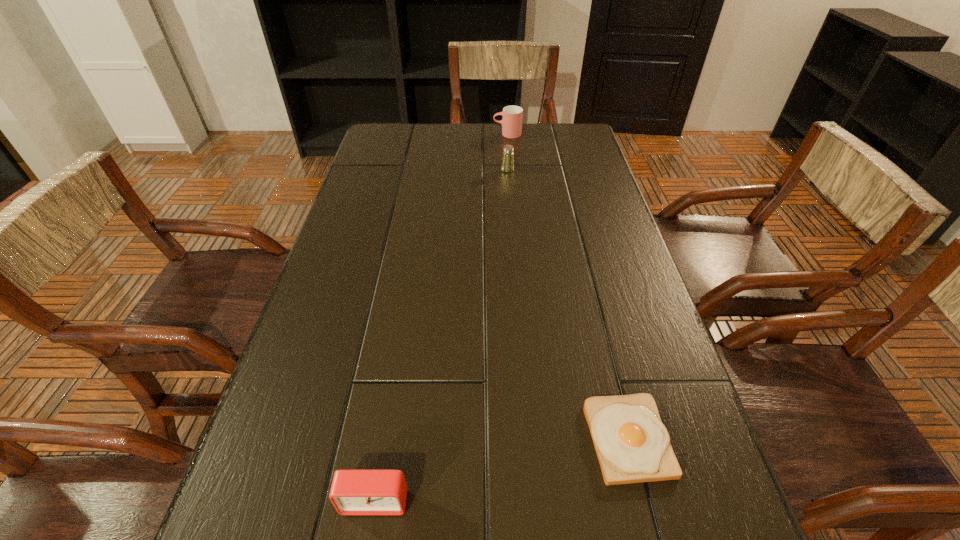
Identify the location of vacant area between the shortest object and the third nearest object. This screenshot has width=960, height=540. (567, 304).

The width and height of the screenshot is (960, 540). I want to click on free point between the alarm clock and the saltshaker, so click(442, 335).

Where is `vacant space that's between the cup and the leftmost object`? Image resolution: width=960 pixels, height=540 pixels. vacant space that's between the cup and the leftmost object is located at coordinates (441, 317).

Find the location of a particular element. The width and height of the screenshot is (960, 540). free space that is in between the rightmost object and the saltshaker is located at coordinates [567, 304].

Identify the location of free spot between the leftmost object and the shortest object. Image resolution: width=960 pixels, height=540 pixels. (501, 469).

Image resolution: width=960 pixels, height=540 pixels. In order to click on free spot between the farthest object and the rightmost object in this screenshot , I will do `click(567, 286)`.

Locate an element on the screen. object that stands as the third closest to the third nearest object is located at coordinates (353, 492).

The width and height of the screenshot is (960, 540). I want to click on the third closest object to the saltshaker, so click(x=353, y=492).

Locate an element on the screen. The image size is (960, 540). vacant space that satisfies the following two spatial constraints: 1. on the back side of the third nearest object; 2. on the side of the farthest object with the handle is located at coordinates (504, 134).